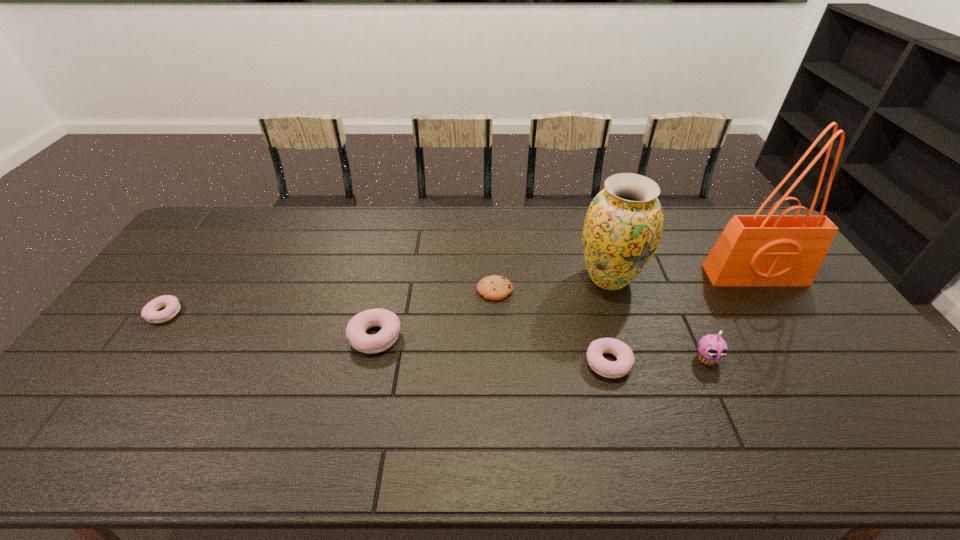
Identify the location of empty space between the second tallest doughnut and the shortest object. (551, 326).

Identify the location of empty space between the third object from left to right and the tallest doughnut. The width and height of the screenshot is (960, 540). (435, 313).

Where is `free space between the fifth object from right to left and the second object from right to left`? The image size is (960, 540). free space between the fifth object from right to left and the second object from right to left is located at coordinates click(601, 324).

Find the location of `vacant point located between the third tallest object and the fifth object from right to left`. vacant point located between the third tallest object and the fifth object from right to left is located at coordinates (601, 324).

Image resolution: width=960 pixels, height=540 pixels. Find the location of `free space between the shortest doughnut and the fifth shortest object`. free space between the shortest doughnut and the fifth shortest object is located at coordinates (436, 336).

Where is `empty space that is in between the tallest object and the sixth object from left to right`? This screenshot has height=540, width=960. empty space that is in between the tallest object and the sixth object from left to right is located at coordinates (731, 317).

This screenshot has width=960, height=540. Identify the location of free space between the vase and the leftmost object. (387, 295).

In order to click on free point between the vase and the leftmost object in this screenshot , I will do `click(387, 295)`.

Locate an element on the screen. object that is the second closest to the rightmost doughnut is located at coordinates (711, 348).

At what (x,y) coordinates should I click in order to perform the action: click on object that can be found as the second closest to the shortest object. Please return your answer as a coordinate pair (x, y). Looking at the image, I should click on (356, 328).